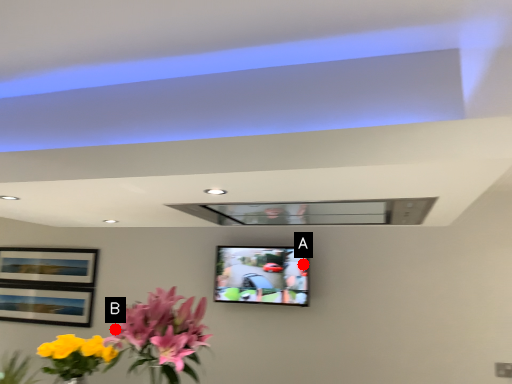
Question: Two points are circled on the image, labeled by A and B beside each circle. Which point is farther from the camera taking this photo?

Choices:
 (A) A is further
 (B) B is further

Answer: (A)